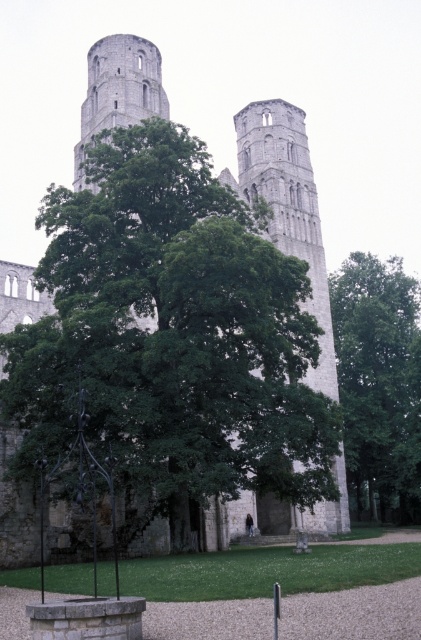
You are a photographer planning to capture a wide shot of the gray stone tower at center and the green leafy tree at center. Based on their sizes, which object should you focus on to ensure both fit within the frame without cropping?

The green leafy tree at center has a larger width than the gray stone tower at center, so focusing on the tree ensures both objects fit without cropping.

From the picture: You are standing in front of the historic stone structure and notice a green leafy tree at center and a gray stone tower at center. Which object is positioned to the left side of the other?

The green leafy tree at center is to the left of the gray stone tower at center.

You are a bird looking for a place to perch. You see two green leafy trees in the image. Which tree, the green leafy tree at center or the green leafy tree at right, is positioned higher up in the image?

The green leafy tree at center is located above the green leafy tree at right, so it is positioned higher up in the image.